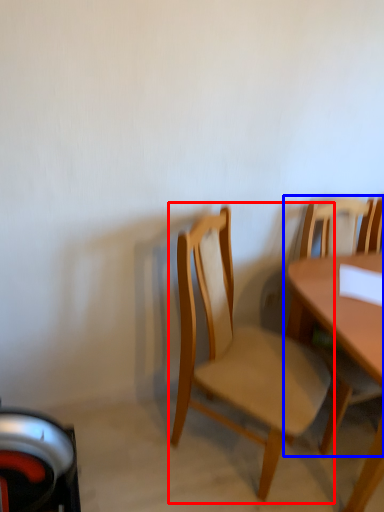
Question: Which point is further to the camera, chair (highlighted by a red box) or chair (highlighted by a blue box)?

Choices:
 (A) chair
 (B) chair

Answer: (B)